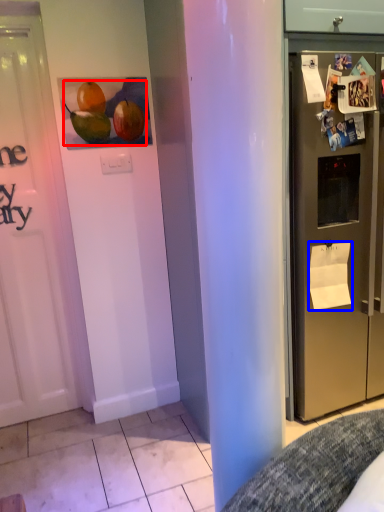
Question: Which point is closer to the camera, fruit (highlighted by a red box) or paper (highlighted by a blue box)?

Choices:
 (A) fruit
 (B) paper

Answer: (A)